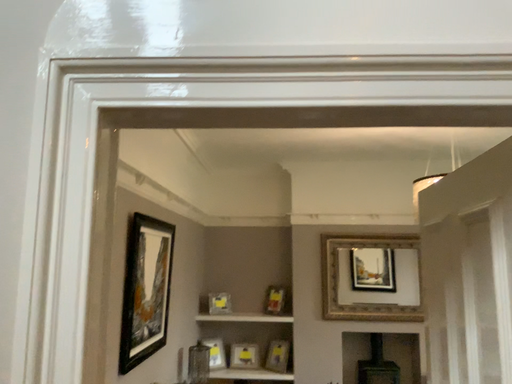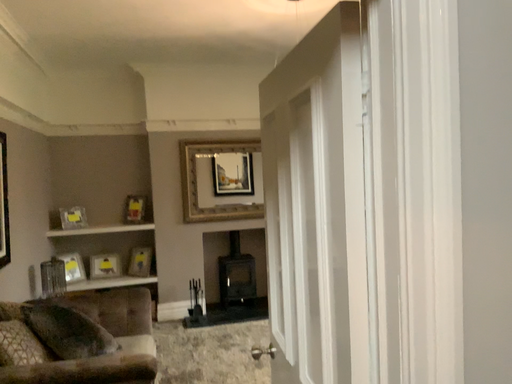
Question: Which way did the camera rotate in the video?

Choices:
 (A) rotated downward
 (B) rotated upward

Answer: (A)